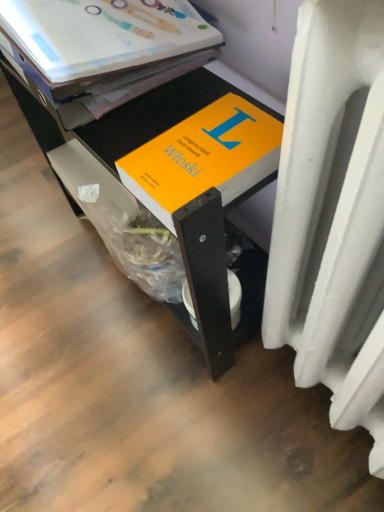
The height and width of the screenshot is (512, 384). In order to click on white plastic heater at lower right in this screenshot , I will do `click(333, 215)`.

In order to face orange matte book at center, should I rotate leftwards or rightwards?

A 5.358 degree turn to the left will do.

I want to click on orange matte book at upper center, so click(x=102, y=34).

Is orange matte book at upper center turned away from orange matte book at center?

No, orange matte book at upper center's orientation is not away from orange matte book at center.

Based on the photo, how distant is orange matte book at upper center from orange matte book at center?

6.34 inches.

How many degrees apart are the facing directions of orange matte book at upper center and orange matte book at center?

0.00132 degrees separate the facing orientations of orange matte book at upper center and orange matte book at center.

Choose the correct answer: Is orange matte book at upper center inside orange matte book at center or outside it?

orange matte book at upper center exists outside the volume of orange matte book at center.

Considering the sizes of objects white plastic heater at lower right and orange matte book at upper center in the image provided, who is bigger, white plastic heater at lower right or orange matte book at upper center?

Bigger between the two is orange matte book at upper center.

Which is correct: white plastic heater at lower right is inside orange matte book at upper center, or outside of it?

white plastic heater at lower right is spatially situated outside orange matte book at upper center.

Is white plastic heater at lower right oriented away from orange matte book at upper center?

No, white plastic heater at lower right is not facing the opposite direction of orange matte book at upper center.

How different are the orientations of orange matte book at center and orange matte book at upper center in degrees?

The angular difference between orange matte book at center and orange matte book at upper center is 0.00132 degrees.

Does orange matte book at center turn towards orange matte book at upper center?

No, orange matte book at center is not oriented towards orange matte book at upper center.

From a real-world perspective, is orange matte book at center beneath orange matte book at upper center?

Correct, in the physical world, orange matte book at center is lower than orange matte book at upper center.

You are a GUI agent. You are given a task and a screenshot of the screen. Output one action in this format:
    pyautogui.click(x=<x>, y=<y>)
    Task: Click on the paperback book above the orange matte book at center (from a real-world perspective)
    The height and width of the screenshot is (512, 384).
    Given the screenshot: What is the action you would take?
    pyautogui.click(x=102, y=34)

From the image's perspective, is orange matte book at center located above or below white plastic heater at lower right?

orange matte book at center is above white plastic heater at lower right.

What's the angular difference between orange matte book at center and white plastic heater at lower right's facing directions?

The angle between the facing direction of orange matte book at center and the facing direction of white plastic heater at lower right is 0.284 degrees.

Is orange matte book at center next to white plastic heater at lower right and touching it?

No, orange matte book at center is not beside white plastic heater at lower right.

Based on their sizes in the image, would you say white plastic heater at lower right is bigger or smaller than orange matte book at center?

white plastic heater at lower right is bigger than orange matte book at center.

Is white plastic heater at lower right at the right side of orange matte book at center?

Indeed, white plastic heater at lower right is positioned on the right side of orange matte book at center.

Based on the photo, from a real-world perspective, between white plastic heater at lower right and orange matte book at center, who is vertically lower?

white plastic heater at lower right, from a real-world perspective.

Can you tell me how much white plastic heater at lower right and orange matte book at center differ in facing direction?

There is a 0.284-degree angle between the facing directions of white plastic heater at lower right and orange matte book at center.

Can you confirm if orange matte book at center is wider than orange matte book at upper center?

Incorrect, the width of orange matte book at center does not surpass that of orange matte book at upper center.

Is orange matte book at center bigger or smaller than orange matte book at upper center?

Clearly, orange matte book at center is larger in size than orange matte book at upper center.

From the image's perspective, is orange matte book at center beneath orange matte book at upper center?

Yes, from the image's perspective, orange matte book at center is below orange matte book at upper center.

Which object is closer to the camera, orange matte book at center or orange matte book at upper center?

orange matte book at upper center is closer to the camera.

Consider the image. From a real-world perspective, is orange matte book at center positioned above or below orange matte book at center?

Clearly, from a real-world perspective, orange matte book at center is above orange matte book at center.

From the picture: Are orange matte book at center and orange matte book at center far apart?

Actually, orange matte book at center and orange matte book at center are a little close together.

Do you think orange matte book at center is within orange matte book at center, or outside of it?

orange matte book at center is located inside orange matte book at center.

The height and width of the screenshot is (512, 384). Find the location of `book below the orange matte book at upper center (from the image's perspective)`. book below the orange matte book at upper center (from the image's perspective) is located at coordinates (204, 157).

Find the location of `heater in front of the orange matte book at upper center`. heater in front of the orange matte book at upper center is located at coordinates (333, 215).

When comparing their distances from white plastic heater at lower right, does orange matte book at upper center or orange matte book at center seem further?

orange matte book at upper center is further to white plastic heater at lower right.

Estimate the real-world distances between objects in this image. Which object is further from orange matte book at center, white plastic heater at lower right or orange matte book at center?

Among the two, white plastic heater at lower right is located further to orange matte book at center.

Estimate the real-world distances between objects in this image. Which object is further from orange matte book at upper center, orange matte book at center or white plastic heater at lower right?

Among the two, white plastic heater at lower right is located further to orange matte book at upper center.

From the image, which object appears to be farther from white plastic heater at lower right, orange matte book at center or orange matte book at upper center?

orange matte book at upper center is further to white plastic heater at lower right.

Considering their positions, is orange matte book at center positioned closer to white plastic heater at lower right than orange matte book at center?

Among the two, orange matte book at center is located nearer to white plastic heater at lower right.

From the image, which object appears to be farther from orange matte book at center, orange matte book at center or orange matte book at upper center?

orange matte book at upper center lies further to orange matte book at center than the other object.

Which object lies further to the anchor point orange matte book at center, orange matte book at center or white plastic heater at lower right?

white plastic heater at lower right is further to orange matte book at center.

Estimate the real-world distances between objects in this image. Which object is further from orange matte book at upper center, white plastic heater at lower right or orange matte book at center?

white plastic heater at lower right.

Where is `desk between orange matte book at upper center and white plastic heater at lower right vertically`? This screenshot has width=384, height=512. desk between orange matte book at upper center and white plastic heater at lower right vertically is located at coordinates 172,175.

The width and height of the screenshot is (384, 512). In order to click on desk positioned between white plastic heater at lower right and orange matte book at center from near to far in this screenshot , I will do `click(172, 175)`.

This screenshot has height=512, width=384. Identify the location of book between orange matte book at upper center and white plastic heater at lower right vertically. (204, 157).

Identify the location of desk between orange matte book at upper center and orange matte book at center vertically. (172, 175).